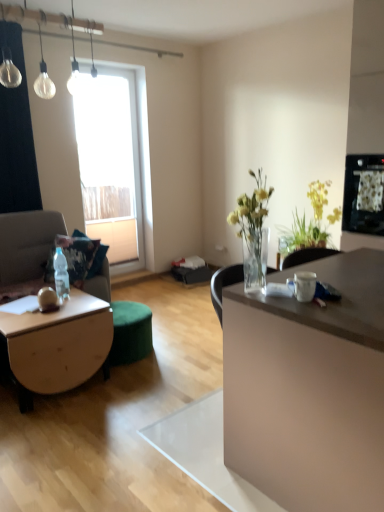
What is the approximate width of yellow-green leafy plant at upper right?

yellow-green leafy plant at upper right is 7.61 inches wide.

Image resolution: width=384 pixels, height=512 pixels. What do you see at coordinates (303, 285) in the screenshot? I see `white glossy mug at center` at bounding box center [303, 285].

Describe the element at coordinates (27, 244) in the screenshot. I see `light brown fabric swivel chair at left` at that location.

Identify the location of clear plastic bottle at lower left. This screenshot has width=384, height=512. (61, 275).

Where is `transparent glass window at upper left`? This screenshot has height=512, width=384. transparent glass window at upper left is located at coordinates (110, 163).

The image size is (384, 512). Describe the element at coordinates (27, 244) in the screenshot. I see `matte beige couch at left` at that location.

This screenshot has height=512, width=384. I want to click on yellow-green leafy plant at upper right, so click(x=309, y=222).

Consider the image. What's the angular difference between transparent glass window at upper left and clear glass light bulb at upper left's facing directions?

The angular difference between transparent glass window at upper left and clear glass light bulb at upper left is 1.04 degrees.

This screenshot has height=512, width=384. What are the coordinates of `window to the left of clear glass light bulb at upper left` in the screenshot? It's located at (110, 163).

Based on their sizes in the image, would you say transparent glass window at upper left is bigger or smaller than clear glass light bulb at upper left?

transparent glass window at upper left is bigger than clear glass light bulb at upper left.

From the image's perspective, would you say transparent glass window at upper left is positioned over clear glass light bulb at upper left?

No.

Looking at this image, who is taller, white glossy mug at center or light brown fabric swivel chair at left?

With more height is light brown fabric swivel chair at left.

Find the location of a particular element. This screenshot has width=384, height=512. coffee cup above the light brown fabric swivel chair at left (from a real-world perspective) is located at coordinates (303, 285).

Is white glossy mug at center in front of or behind light brown fabric swivel chair at left in the image?

Clearly, white glossy mug at center is in front of light brown fabric swivel chair at left.

Considering the relative sizes of white glossy mug at center and light brown fabric swivel chair at left in the image provided, is white glossy mug at center wider than light brown fabric swivel chair at left?

No.

How much distance is there between white glossy mug at center and clear plastic bottle at lower left?

white glossy mug at center is 1.82 meters from clear plastic bottle at lower left.

Which is more distant, (302,298) or (54,272)?

Positioned behind is point (54,272).

From the image's perspective, which one is positioned lower, white glossy mug at center or clear plastic bottle at lower left?

white glossy mug at center is shown below in the image.

Considering the relative sizes of clear glass light bulb at upper left and wooden coffee table at lower left in the image provided, is clear glass light bulb at upper left thinner than wooden coffee table at lower left?

Indeed, clear glass light bulb at upper left has a lesser width compared to wooden coffee table at lower left.

Is point (46, 15) in front of point (97, 322)?

No, it is behind (97, 322).

What are the coordinates of `lamp on the right of wooden coffee table at lower left` in the screenshot? It's located at (41, 39).

Considering the relative sizes of matte white desk at right and wooden coffee table at lower left in the image provided, is matte white desk at right shorter than wooden coffee table at lower left?

Incorrect, the height of matte white desk at right does not fall short of that of wooden coffee table at lower left.

Is matte white desk at right bigger than wooden coffee table at lower left?

Yes.

Is matte white desk at right touching wooden coffee table at lower left?

No.

Could you tell me if yellow-green leafy plant at upper right is facing transparent glass window at upper left?

No, yellow-green leafy plant at upper right is not turned towards transparent glass window at upper left.

You are a GUI agent. You are given a task and a screenshot of the screen. Output one action in this format:
    pyautogui.click(x=<x>, y=<y>)
    Task: Click on the window above the yellow-green leafy plant at upper right (from a real-world perspective)
    The height and width of the screenshot is (512, 384).
    Given the screenshot: What is the action you would take?
    pyautogui.click(x=110, y=163)

Can you tell me how much yellow-green leafy plant at upper right and transparent glass window at upper left differ in facing direction?

The facing directions of yellow-green leafy plant at upper right and transparent glass window at upper left are 91.1 degrees apart.

Would you say yellow-green leafy plant at upper right contains transparent glass window at upper left?

No, transparent glass window at upper left is located outside of yellow-green leafy plant at upper right.

What's the angular difference between transparent glass window at upper left and yellow-green leafy plant at upper right's facing directions?

They differ by 91.1 degrees in their facing directions.

Which of these two, transparent glass window at upper left or yellow-green leafy plant at upper right, is smaller?

yellow-green leafy plant at upper right.

Which object is positioned more to the right, transparent glass window at upper left or yellow-green leafy plant at upper right?

yellow-green leafy plant at upper right is more to the right.

You are a GUI agent. You are given a task and a screenshot of the screen. Output one action in this format:
    pyautogui.click(x=<x>, y=<y>)
    Task: Click on the window that is below the clear glass light bulb at upper left (from the image's perspective)
    
    Given the screenshot: What is the action you would take?
    pyautogui.click(x=110, y=163)

Identify the location of swivel chair behind the white glossy mug at center. (x=27, y=244).

Estimate the real-world distances between objects in this image. Which object is closer to clear glass light bulb at upper left, matte white desk at right or white glossy mug at center?

Based on the image, white glossy mug at center appears to be nearer to clear glass light bulb at upper left.

Based on their spatial positions, is white glossy mug at center or matte beige couch at left further from light brown fabric swivel chair at left?

The object further to light brown fabric swivel chair at left is white glossy mug at center.

Based on their spatial positions, is white glossy mug at center or light brown fabric swivel chair at left closer to matte beige couch at left?

light brown fabric swivel chair at left is closer to matte beige couch at left.

Which object lies further to the anchor point light brown fabric swivel chair at left, wooden coffee table at lower left or clear glass light bulb at upper left?

clear glass light bulb at upper left lies further to light brown fabric swivel chair at left than the other object.

When comparing their distances from matte white desk at right, does clear glass light bulb at upper left or white glossy mug at center seem further?

clear glass light bulb at upper left is further to matte white desk at right.

When comparing their distances from transparent glass window at upper left, does matte beige couch at left or wooden coffee table at lower left seem closer?

matte beige couch at left is positioned closer to the anchor transparent glass window at upper left.

Based on their spatial positions, is white glossy mug at center or light brown fabric swivel chair at left closer to transparent glass window at upper left?

Among the two, light brown fabric swivel chair at left is located nearer to transparent glass window at upper left.

In the scene shown: When comparing their distances from matte beige couch at left, does light brown fabric swivel chair at left or transparent glass window at upper left seem closer?

Among the two, light brown fabric swivel chair at left is located nearer to matte beige couch at left.

The height and width of the screenshot is (512, 384). In order to click on lamp between matte beige couch at left and matte white desk at right in this screenshot , I will do `click(41, 39)`.

At what (x,y) coordinates should I click in order to perform the action: click on studio couch between clear plastic bottle at lower left and transparent glass window at upper left in the front-back direction. Please return your answer as a coordinate pair (x, y). The width and height of the screenshot is (384, 512). Looking at the image, I should click on (27, 244).

This screenshot has width=384, height=512. What are the coordinates of `coffee cup between clear glass light bulb at upper left and wooden coffee table at lower left in the vertical direction` in the screenshot? It's located at (303, 285).

At what (x,y) coordinates should I click in order to perform the action: click on lamp between white glossy mug at center and transparent glass window at upper left in the front-back direction. Please return your answer as a coordinate pair (x, y). The height and width of the screenshot is (512, 384). Looking at the image, I should click on (41, 39).